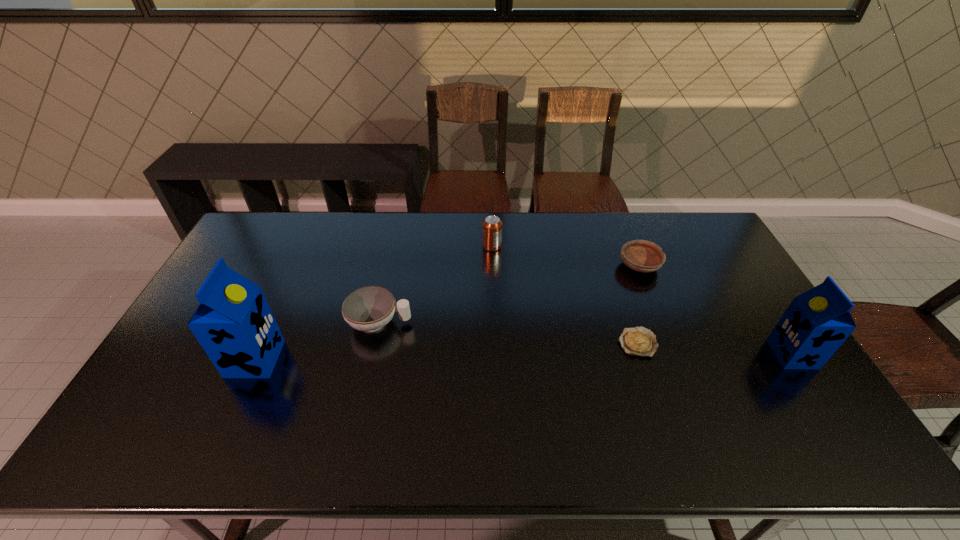
This screenshot has width=960, height=540. I want to click on the shortest object, so click(639, 341).

Identify the location of vacant region located with the cap open on the left carton. This screenshot has height=540, width=960. (358, 359).

Image resolution: width=960 pixels, height=540 pixels. Identify the location of vacant space positioned with the cap open on the second tallest object. (641, 354).

I want to click on vacant area located 0.120m with the cap open on the second tallest object, so click(732, 354).

You are a GUI agent. You are given a task and a screenshot of the screen. Output one action in this format:
    pyautogui.click(x=<x>, y=<y>)
    Task: Click on the vacant area located with the cap open on the second tallest object
    The height and width of the screenshot is (540, 960).
    Given the screenshot: What is the action you would take?
    pyautogui.click(x=732, y=354)

Identify the location of vacant space situated 0.310m on the front of the second shortest object. Image resolution: width=960 pixels, height=540 pixels. (676, 357).

What are the coordinates of `vacant region located on the right of the farthest object` in the screenshot? It's located at (613, 246).

Image resolution: width=960 pixels, height=540 pixels. I want to click on free space located 0.070m on the side with the handle of the fourth tallest object, so click(x=435, y=323).

I want to click on vacant space located on the left of the quiche, so coord(565,342).

The image size is (960, 540). I want to click on object located in the far edge section of the desktop, so click(491, 226).